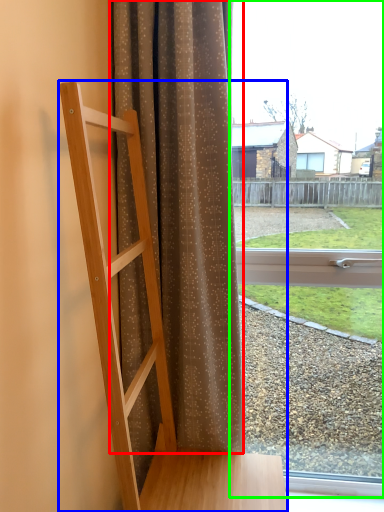
Question: Estimate the real-world distances between objects in this image. Which object is farther from curtain (highlighted by a red box), furniture (highlighted by a blue box) or window (highlighted by a green box)?

Choices:
 (A) furniture
 (B) window

Answer: (B)